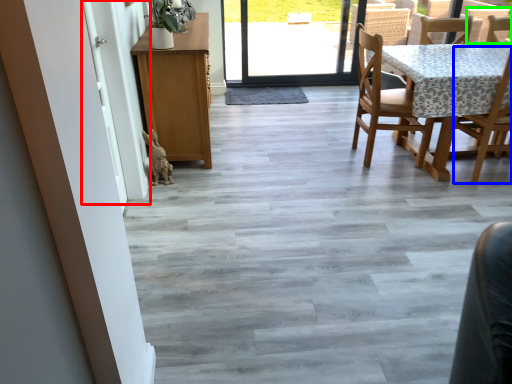
Question: Based on their relative distances, which object is farther from screen door (highlighted by a red box)? Choose from chair (highlighted by a blue box) and armchair (highlighted by a green box).

Choices:
 (A) chair
 (B) armchair

Answer: (B)